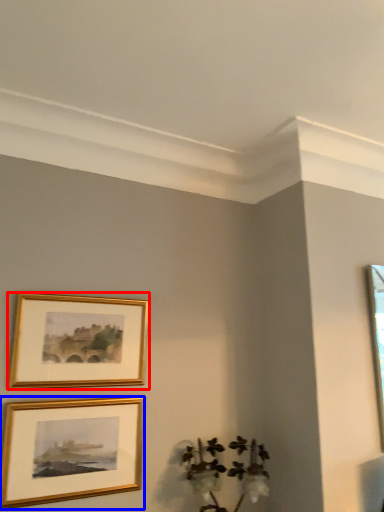
Question: Which point is further to the camera, picture frame (highlighted by a red box) or picture frame (highlighted by a blue box)?

Choices:
 (A) picture frame
 (B) picture frame

Answer: (A)